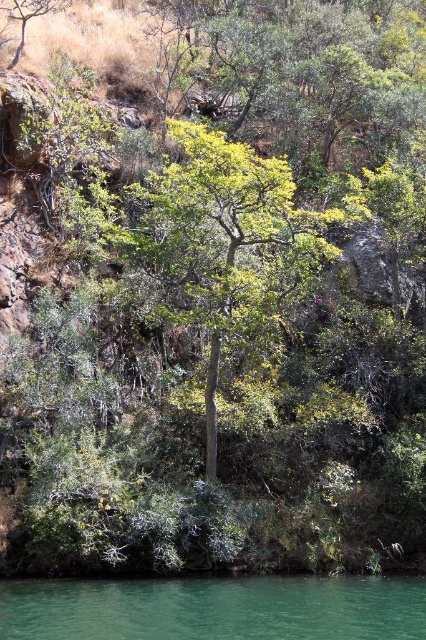
Question: Which point is closer to the camera?

Choices:
 (A) coord(319,237)
 (B) coord(131,612)

Answer: (B)

Question: Is the position of green leafy tree at center more distant than that of green translucent water at lower center?

Choices:
 (A) no
 (B) yes

Answer: (B)

Question: Is green leafy tree at center further to the viewer compared to green translucent water at lower center?

Choices:
 (A) yes
 (B) no

Answer: (A)

Question: Which object appears closest to the camera in this image?

Choices:
 (A) green leafy tree at center
 (B) green translucent water at lower center

Answer: (B)

Question: Does green leafy tree at center appear under green translucent water at lower center?

Choices:
 (A) no
 (B) yes

Answer: (A)